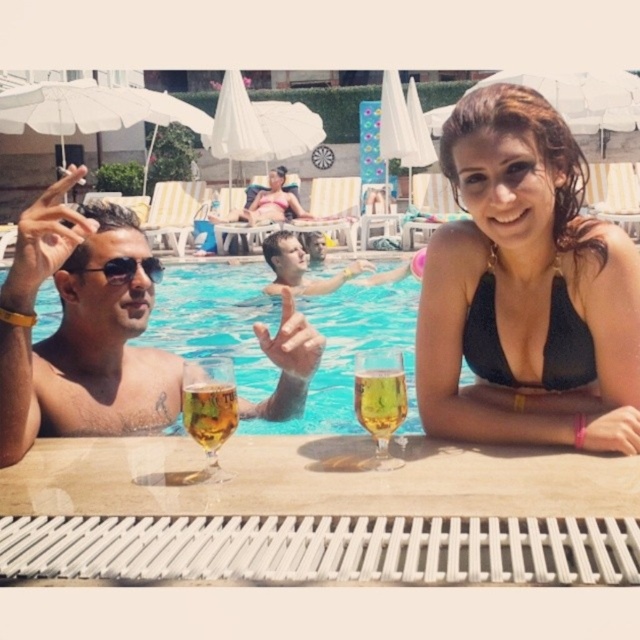
Question: Is matte black bikini at upper right to the left of translucent glass wine glass at center from the viewer's perspective?

Choices:
 (A) no
 (B) yes

Answer: (A)

Question: Based on their relative distances, which object is farther from the smooth skin man at center?

Choices:
 (A) sunglasses at upper left
 (B) black matte bikini top at upper right
 (C) white plastic table at lower center

Answer: (C)

Question: Which point is closer to the camera?

Choices:
 (A) (561, 467)
 (B) (620, 420)

Answer: (A)

Question: Among these objects, which one is farthest from the camera?

Choices:
 (A) white plastic table at lower center
 (B) matte black bikini at upper right
 (C) smooth skin man at center
 (D) black matte bikini at upper right

Answer: (C)

Question: Observing the image, what is the correct spatial positioning of matte black bikini at upper right in reference to transparent glass water at center?

Choices:
 (A) left
 (B) right

Answer: (B)

Question: Can you confirm if white plastic table at lower center is positioned below black matte bikini at upper right?

Choices:
 (A) no
 (B) yes

Answer: (B)